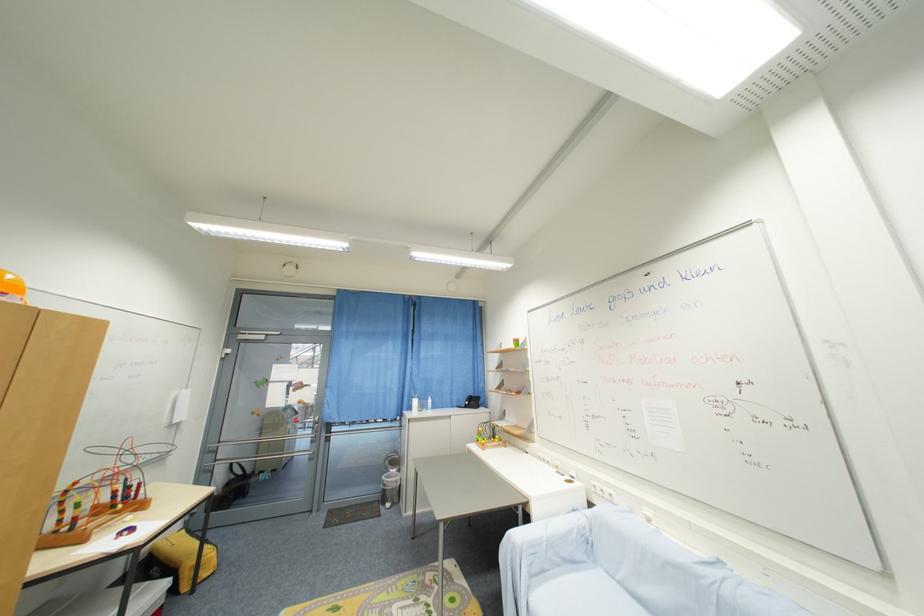
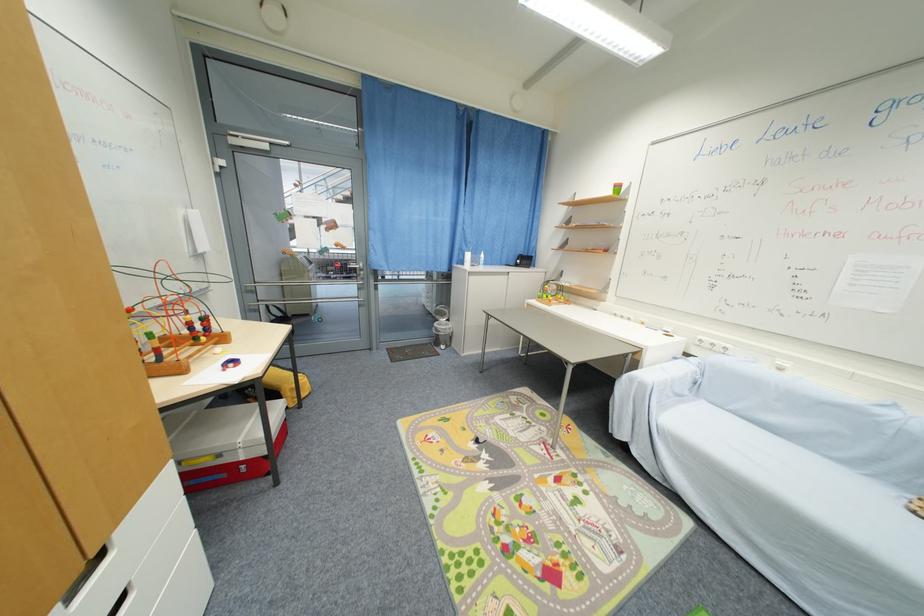
In the second image, find the point that corresponds to [578,513] in the first image.

(681, 360)